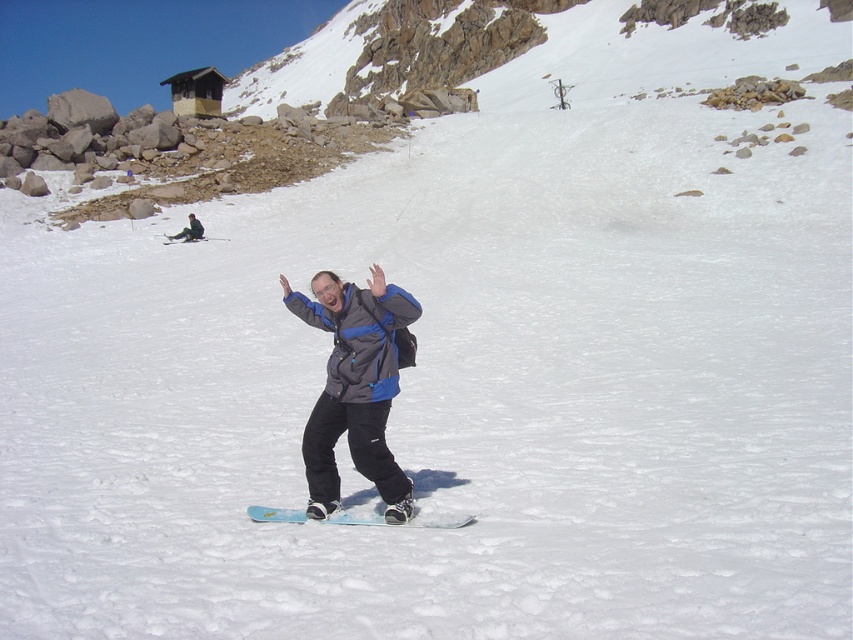
Question: Is blue matte snowboard at center thinner than blue matte snowboard at upper center?

Choices:
 (A) no
 (B) yes

Answer: (A)

Question: Which object is the closest to the gray fabric jacket at upper center?

Choices:
 (A) blue matte snowboard at upper center
 (B) blue plastic snowboard at center

Answer: (A)

Question: Considering the real-world distances, which object is closest to the blue plastic snowboard at center?

Choices:
 (A) gray fabric jacket at upper center
 (B) blue matte snowboard at upper center

Answer: (B)

Question: Does gray fabric jacket at upper center appear under blue matte snowboard at upper center?

Choices:
 (A) yes
 (B) no

Answer: (B)

Question: Estimate the real-world distances between objects in this image. Which object is closer to the gray fabric jacket at upper center?

Choices:
 (A) blue matte snowboard at upper center
 (B) blue plastic snowboard at center

Answer: (A)

Question: Is blue matte snowboard at center above gray fabric jacket at upper center?

Choices:
 (A) yes
 (B) no

Answer: (B)